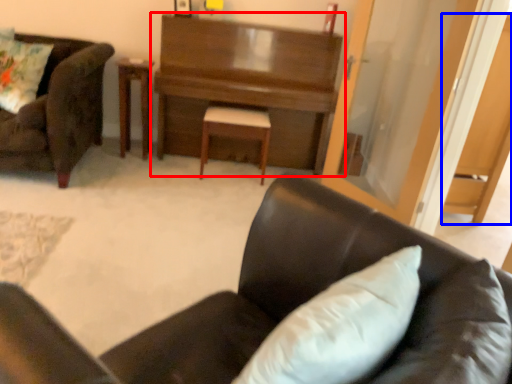
Question: Among these objects, which one is farthest to the camera, desk (highlighted by a red box) or dark (highlighted by a blue box)?

Choices:
 (A) desk
 (B) dark

Answer: (A)